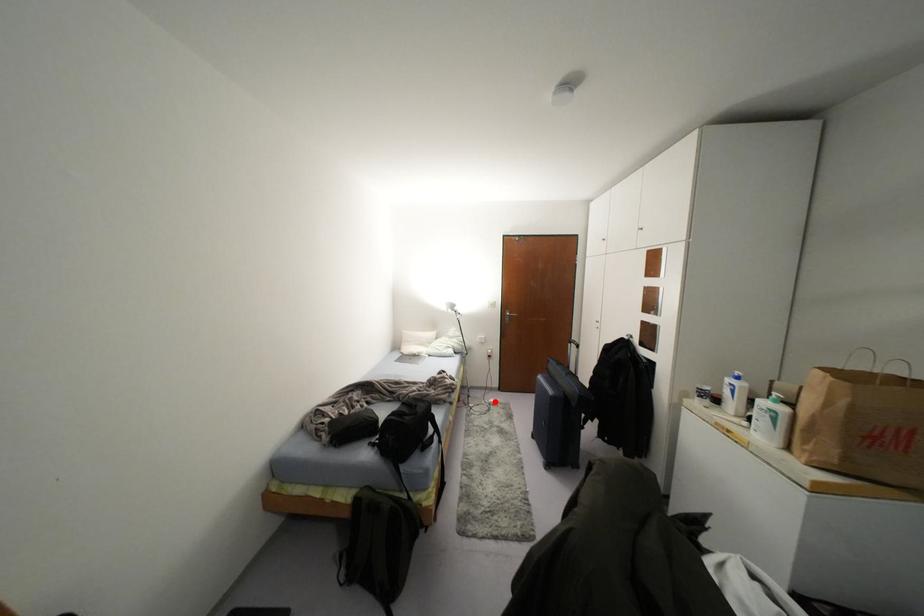
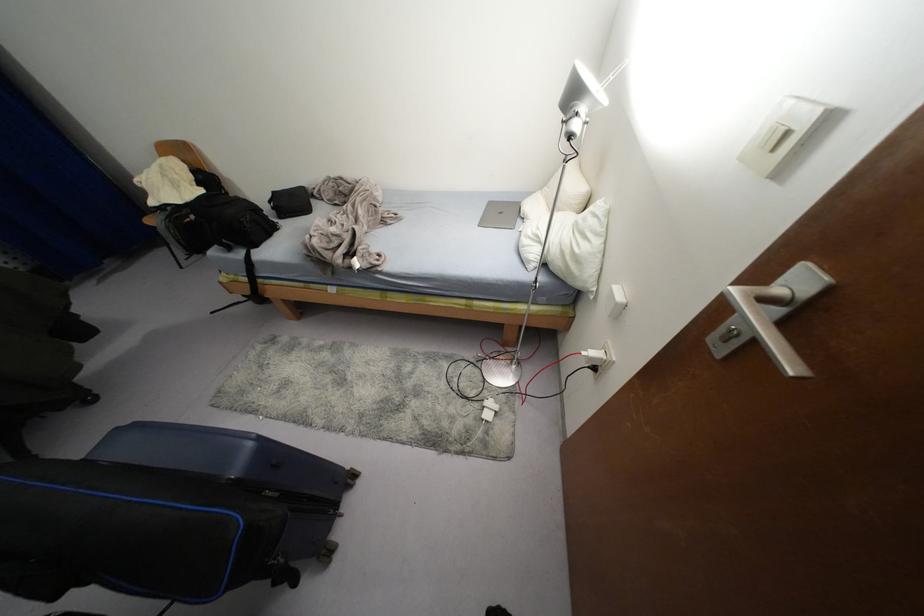
Question: I am providing you with two images of the same scene from different viewpoints. Given a red point in image1, look at the same physical point in image2. Is it:

Choices:
 (A) Closer to the viewpoint
 (B) Farther from the viewpoint

Answer: (A)